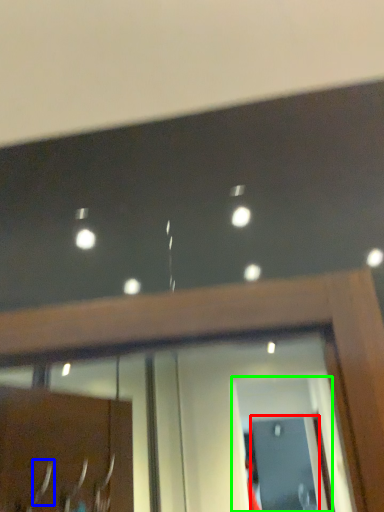
Question: Considering the real-world distances, which object is farthest from screen door (highlighted by a red box)? door handle (highlighted by a blue box) or screen door (highlighted by a green box)?

Choices:
 (A) door handle
 (B) screen door

Answer: (A)